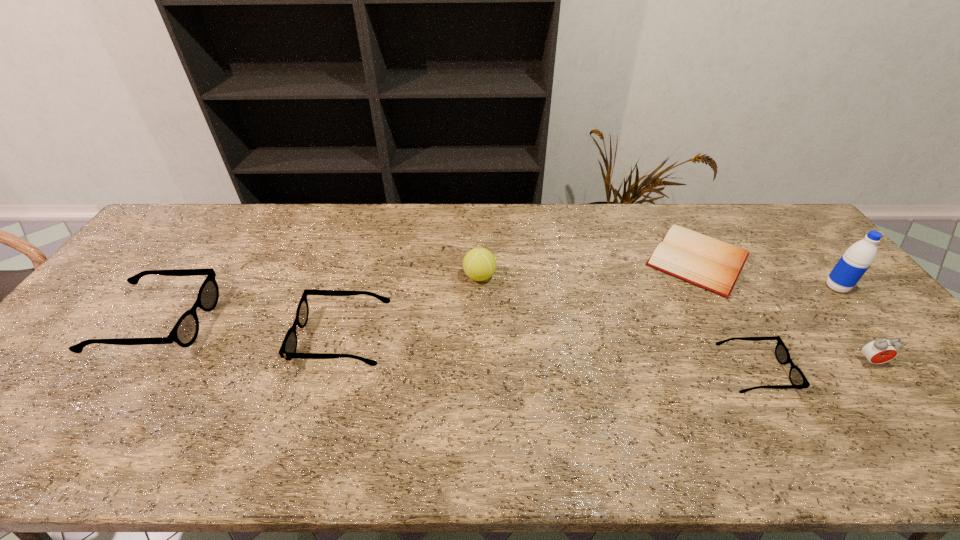
Locate an element on the screen. This screenshot has width=960, height=540. vacant region located on the arms of the leftmost spectacles is located at coordinates (279, 323).

This screenshot has width=960, height=540. Find the location of `blank area located 0.180m on the arms of the second shortest spectacles`. blank area located 0.180m on the arms of the second shortest spectacles is located at coordinates (231, 338).

The width and height of the screenshot is (960, 540). I want to click on vacant region located 0.140m on the arms of the second shortest spectacles, so click(x=247, y=338).

Locate an element on the screen. The image size is (960, 540). vacant space located on the arms of the second shortest spectacles is located at coordinates (198, 338).

The image size is (960, 540). Identify the location of free region located 0.320m on the arms of the rightmost spectacles. (916, 372).

You are a GUI agent. You are given a task and a screenshot of the screen. Output one action in this format:
    pyautogui.click(x=<x>, y=<y>)
    Task: Click on the vacant space located on the right of the shortest object
    Image resolution: width=960 pixels, height=540 pixels.
    Given the screenshot: What is the action you would take?
    pyautogui.click(x=775, y=260)

Identify the location of vacant region located on the back of the water bottle. This screenshot has height=540, width=960. (802, 246).

At what (x,y) coordinates should I click in order to perform the action: click on vacant region located on the left of the tennis ball. Please return your answer as a coordinate pair (x, y). Looking at the image, I should click on (410, 276).

I want to click on vacant region located on the face of the second object from right to left, so click(912, 416).

This screenshot has width=960, height=540. Identify the location of object that is at the far edge. (714, 265).